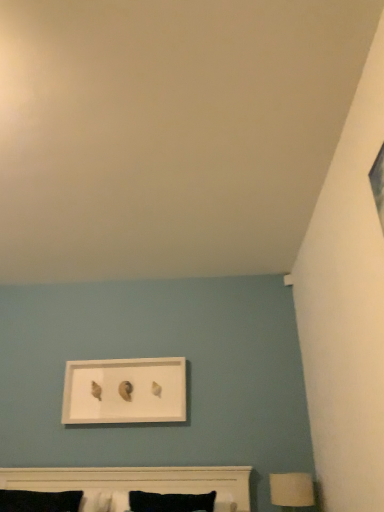
Question: Does white matte picture frame at upper center have a greater height compared to white matte table lamp at lower right?

Choices:
 (A) no
 (B) yes

Answer: (B)

Question: Does white matte picture frame at upper center have a lesser height compared to white matte table lamp at lower right?

Choices:
 (A) yes
 (B) no

Answer: (B)

Question: Does white matte picture frame at upper center turn towards white matte table lamp at lower right?

Choices:
 (A) yes
 (B) no

Answer: (B)

Question: Does white matte picture frame at upper center have a greater width compared to white matte table lamp at lower right?

Choices:
 (A) no
 (B) yes

Answer: (A)

Question: Does white matte picture frame at upper center have a larger size compared to white matte table lamp at lower right?

Choices:
 (A) yes
 (B) no

Answer: (A)

Question: Is white matte picture frame at upper center looking in the opposite direction of white matte table lamp at lower right?

Choices:
 (A) yes
 (B) no

Answer: (B)

Question: Are white matte bed at lower center and white matte picture frame at upper center far apart?

Choices:
 (A) no
 (B) yes

Answer: (A)

Question: Is the depth of white matte bed at lower center less than that of white matte picture frame at upper center?

Choices:
 (A) no
 (B) yes

Answer: (B)

Question: Can you confirm if white matte bed at lower center is taller than white matte picture frame at upper center?

Choices:
 (A) yes
 (B) no

Answer: (B)

Question: Does white matte bed at lower center have a lesser width compared to white matte picture frame at upper center?

Choices:
 (A) yes
 (B) no

Answer: (B)

Question: From a real-world perspective, is white matte bed at lower center on top of white matte picture frame at upper center?

Choices:
 (A) no
 (B) yes

Answer: (A)

Question: Is white matte bed at lower center looking in the opposite direction of white matte picture frame at upper center?

Choices:
 (A) yes
 (B) no

Answer: (B)

Question: Considering the relative sizes of white matte table lamp at lower right and white matte bed at lower center in the image provided, is white matte table lamp at lower right wider than white matte bed at lower center?

Choices:
 (A) yes
 (B) no

Answer: (B)